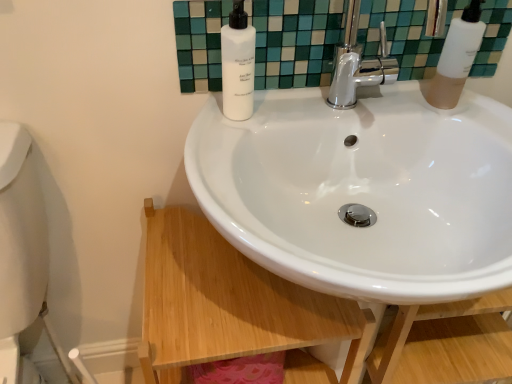
Locate an element on the screen. white matte bottle at upper right, arranged as the 2th soap dispenser when viewed from the left is located at coordinates (457, 57).

What do you see at coordinates (457, 57) in the screenshot?
I see `white matte bottle at upper right, arranged as the 2th soap dispenser when viewed from the left` at bounding box center [457, 57].

The width and height of the screenshot is (512, 384). I want to click on white glossy sink at center, so click(x=362, y=191).

What are the coordinates of `white glossy wood at lower center` in the screenshot? It's located at (233, 307).

Identify the location of white matte bottle at upper center, the first soap dispenser when ordered from left to right. This screenshot has width=512, height=384. (238, 64).

Can you confirm if white glossy sink at center is positioned to the right of white matte bottle at upper center, the first soap dispenser when ordered from left to right?

Yes, white glossy sink at center is to the right of white matte bottle at upper center, the first soap dispenser when ordered from left to right.

Can you confirm if white glossy sink at center is wider than white matte bottle at upper center, which ranks as the second soap dispenser in right-to-left order?

Correct, the width of white glossy sink at center exceeds that of white matte bottle at upper center, which ranks as the second soap dispenser in right-to-left order.

Where is `sink that appears on the right of white matte bottle at upper center, which ranks as the second soap dispenser in right-to-left order`? sink that appears on the right of white matte bottle at upper center, which ranks as the second soap dispenser in right-to-left order is located at coordinates (362, 191).

Is the depth of white glossy sink at center less than that of white matte bottle at upper center, the first soap dispenser when ordered from left to right?

That is True.

In the scene shown: Is white glossy wood at lower center positioned beyond the bounds of white matte bottle at upper center, which ranks as the second soap dispenser in right-to-left order?

Absolutely, white glossy wood at lower center is external to white matte bottle at upper center, which ranks as the second soap dispenser in right-to-left order.

Considering their positions, is white glossy wood at lower center located in front of or behind white matte bottle at upper center, which ranks as the second soap dispenser in right-to-left order?

In the image, white glossy wood at lower center appears in front of white matte bottle at upper center, which ranks as the second soap dispenser in right-to-left order.

Image resolution: width=512 pixels, height=384 pixels. Find the location of `counter top below the white matte bottle at upper center, which ranks as the second soap dispenser in right-to-left order (from a real-world perspective)`. counter top below the white matte bottle at upper center, which ranks as the second soap dispenser in right-to-left order (from a real-world perspective) is located at coordinates (233, 307).

From the image's perspective, is white glossy wood at lower center located above or below white matte bottle at upper center, the first soap dispenser when ordered from left to right?

white glossy wood at lower center is below white matte bottle at upper center, the first soap dispenser when ordered from left to right.

Consider the image. Which point is more forward, (296, 77) or (224, 80)?

The point (224, 80) is more forward.

How different are the orientations of white glossy mirror at upper center and white matte bottle at upper center, which ranks as the second soap dispenser in right-to-left order, in degrees?

They differ by 0.00192 degrees in their facing directions.

Is white glossy mirror at upper center outside of white matte bottle at upper center, the first soap dispenser when ordered from left to right?

Indeed, white glossy mirror at upper center is completely outside white matte bottle at upper center, the first soap dispenser when ordered from left to right.

From the image's perspective, which is below, white matte bottle at upper right, arranged as the 2th soap dispenser when viewed from the left, or white glossy sink at center?

From the image's view, white glossy sink at center is below.

From a real-world perspective, between white matte bottle at upper right, acting as the first soap dispenser starting from the right, and white glossy sink at center, who is vertically higher?

white matte bottle at upper right, acting as the first soap dispenser starting from the right, is physically above.

Considering their positions, is white matte bottle at upper right, arranged as the 2th soap dispenser when viewed from the left, located in front of or behind white glossy sink at center?

Visually, white matte bottle at upper right, arranged as the 2th soap dispenser when viewed from the left, is located behind white glossy sink at center.

Is white matte bottle at upper right, arranged as the 2th soap dispenser when viewed from the left, to the right of white glossy sink at center from the viewer's perspective?

Correct, you'll find white matte bottle at upper right, arranged as the 2th soap dispenser when viewed from the left, to the right of white glossy sink at center.

Considering the positions of objects white matte bottle at upper center, the first soap dispenser when ordered from left to right, and white glossy wood at lower center in the image provided, who is more to the right, white matte bottle at upper center, the first soap dispenser when ordered from left to right, or white glossy wood at lower center?

white glossy wood at lower center is more to the right.

How different are the orientations of white matte bottle at upper center, which ranks as the second soap dispenser in right-to-left order, and white glossy wood at lower center in degrees?

There is a 0.207-degree angle between the facing directions of white matte bottle at upper center, which ranks as the second soap dispenser in right-to-left order, and white glossy wood at lower center.

Does white matte bottle at upper center, which ranks as the second soap dispenser in right-to-left order, have a lesser height compared to white glossy wood at lower center?

Yes.

Is the depth of white matte bottle at upper center, the first soap dispenser when ordered from left to right, less than that of white glossy wood at lower center?

No, the depth of white matte bottle at upper center, the first soap dispenser when ordered from left to right, is greater than that of white glossy wood at lower center.

Is white glossy wood at lower center surrounded by white matte bottle at upper right, arranged as the 2th soap dispenser when viewed from the left?

That's incorrect, white glossy wood at lower center is not inside white matte bottle at upper right, arranged as the 2th soap dispenser when viewed from the left.

From the image's perspective, between white matte bottle at upper right, arranged as the 2th soap dispenser when viewed from the left, and white glossy wood at lower center, who is located below?

white glossy wood at lower center.

Considering the relative positions of white matte bottle at upper right, acting as the first soap dispenser starting from the right, and white glossy wood at lower center in the image provided, is white matte bottle at upper right, acting as the first soap dispenser starting from the right, to the left of white glossy wood at lower center from the viewer's perspective?

Incorrect, white matte bottle at upper right, acting as the first soap dispenser starting from the right, is not on the left side of white glossy wood at lower center.

Which of these two, white matte bottle at upper right, acting as the first soap dispenser starting from the right, or white glossy wood at lower center, stands shorter?

Standing shorter between the two is white matte bottle at upper right, acting as the first soap dispenser starting from the right.

Is white matte bottle at upper center, the first soap dispenser when ordered from left to right, touching white glossy mirror at upper center?

No, white matte bottle at upper center, the first soap dispenser when ordered from left to right, is not with white glossy mirror at upper center.

Does point (224, 43) come in front of point (490, 59)?

Yes, point (224, 43) is in front of point (490, 59).

Which is more to the left, white matte bottle at upper center, which ranks as the second soap dispenser in right-to-left order, or white glossy mirror at upper center?

white matte bottle at upper center, which ranks as the second soap dispenser in right-to-left order, is more to the left.

Between white matte bottle at upper center, the first soap dispenser when ordered from left to right, and white glossy mirror at upper center, which one is positioned behind?

white glossy mirror at upper center.

Where is `sink below the white matte bottle at upper center, which ranks as the second soap dispenser in right-to-left order (from a real-world perspective)`? Image resolution: width=512 pixels, height=384 pixels. sink below the white matte bottle at upper center, which ranks as the second soap dispenser in right-to-left order (from a real-world perspective) is located at coordinates (362, 191).

Where is `soap dispenser lying on the left of white glossy wood at lower center`? The image size is (512, 384). soap dispenser lying on the left of white glossy wood at lower center is located at coordinates (238, 64).

Looking at the image, which one is located further to white glossy sink at center, white matte bottle at upper right, arranged as the 2th soap dispenser when viewed from the left, or white glossy wood at lower center?

white matte bottle at upper right, arranged as the 2th soap dispenser when viewed from the left, lies further to white glossy sink at center than the other object.

From the image, which object appears to be nearer to white glossy sink at center, white matte bottle at upper center, the first soap dispenser when ordered from left to right, or white glossy wood at lower center?

white glossy wood at lower center lies closer to white glossy sink at center than the other object.

Estimate the real-world distances between objects in this image. Which object is further from white glossy sink at center, white glossy mirror at upper center or white matte bottle at upper right, acting as the first soap dispenser starting from the right?

white matte bottle at upper right, acting as the first soap dispenser starting from the right, lies further to white glossy sink at center than the other object.

Looking at the image, which one is located further to white matte bottle at upper right, acting as the first soap dispenser starting from the right, white glossy sink at center or white matte bottle at upper center, the first soap dispenser when ordered from left to right?

Among the two, white matte bottle at upper center, the first soap dispenser when ordered from left to right, is located further to white matte bottle at upper right, acting as the first soap dispenser starting from the right.

When comparing their distances from white glossy wood at lower center, does white glossy sink at center or white glossy mirror at upper center seem closer?

white glossy sink at center.

In the scene shown: Considering their positions, is white matte bottle at upper right, arranged as the 2th soap dispenser when viewed from the left, positioned further to white matte bottle at upper center, the first soap dispenser when ordered from left to right, than white glossy sink at center?

white matte bottle at upper right, arranged as the 2th soap dispenser when viewed from the left.

Which object lies nearer to the anchor point white matte bottle at upper right, arranged as the 2th soap dispenser when viewed from the left, white glossy mirror at upper center or white glossy wood at lower center?

white glossy mirror at upper center is positioned closer to the anchor white matte bottle at upper right, arranged as the 2th soap dispenser when viewed from the left.

Estimate the real-world distances between objects in this image. Which object is closer to white matte bottle at upper center, the first soap dispenser when ordered from left to right, white glossy wood at lower center or white glossy mirror at upper center?

Based on the image, white glossy mirror at upper center appears to be nearer to white matte bottle at upper center, the first soap dispenser when ordered from left to right.

The height and width of the screenshot is (384, 512). In order to click on soap dispenser that lies between white matte bottle at upper right, acting as the first soap dispenser starting from the right, and white glossy wood at lower center from top to bottom in this screenshot , I will do `click(238, 64)`.

Where is `mirror located between white matte bottle at upper center, the first soap dispenser when ordered from left to right, and white matte bottle at upper right, arranged as the 2th soap dispenser when viewed from the left, in the left-right direction`? mirror located between white matte bottle at upper center, the first soap dispenser when ordered from left to right, and white matte bottle at upper right, arranged as the 2th soap dispenser when viewed from the left, in the left-right direction is located at coordinates (295, 41).

The image size is (512, 384). In order to click on sink between white matte bottle at upper center, the first soap dispenser when ordered from left to right, and white glossy wood at lower center vertically in this screenshot , I will do `click(362, 191)`.

Identify the location of sink between white matte bottle at upper right, arranged as the 2th soap dispenser when viewed from the left, and white glossy wood at lower center in the up-down direction. Image resolution: width=512 pixels, height=384 pixels. (362, 191).